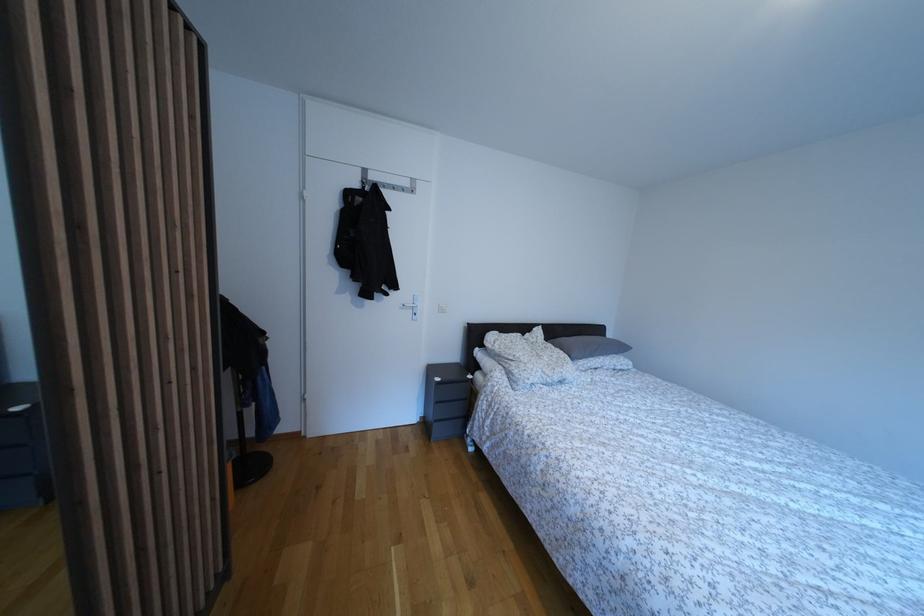
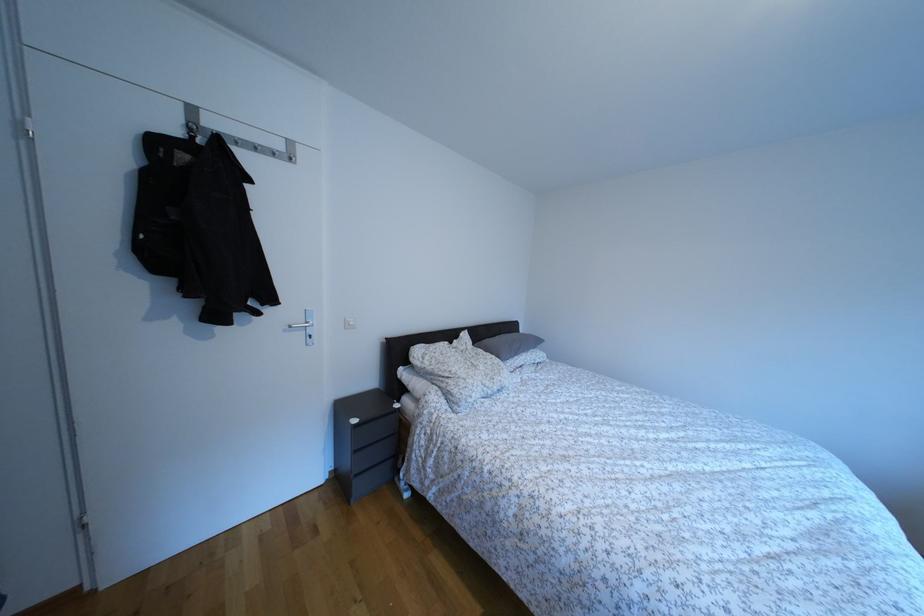
Locate, in the second image, the point that corresponds to point 439,377 in the first image.

(349, 413)